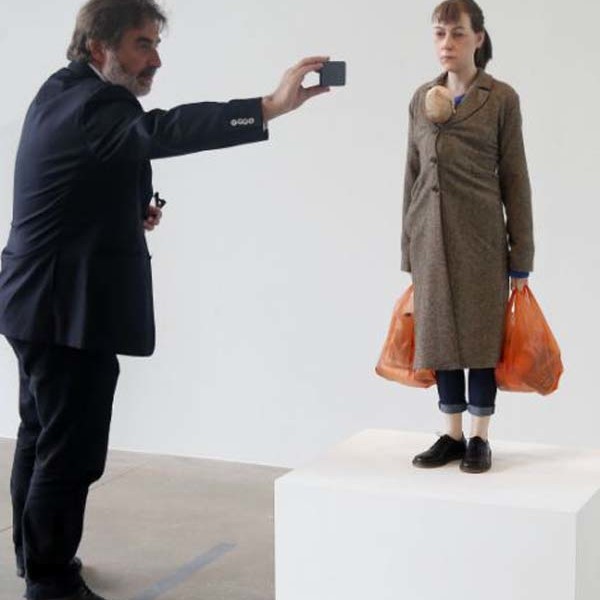
Find the location of a particular element. This screenshot has width=600, height=600. floor is located at coordinates (236, 503).